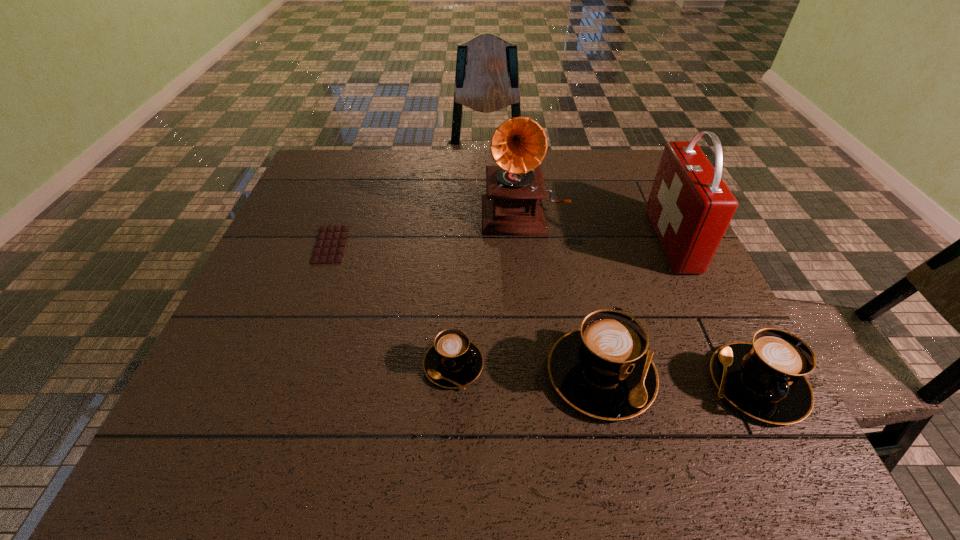
At what (x,y) coordinates should I click in order to perform the action: click on the shortest cappuccino. Please return your answer as a coordinate pair (x, y). This screenshot has height=540, width=960. Looking at the image, I should click on pos(453,361).

I want to click on the second shortest object, so click(x=453, y=361).

At what (x,y) coordinates should I click in order to perform the action: click on the second cappuccino from right to left. Please return your answer as a coordinate pair (x, y). The width and height of the screenshot is (960, 540). Looking at the image, I should click on click(x=602, y=369).

I want to click on the third shortest object, so click(765, 379).

This screenshot has width=960, height=540. I want to click on the second tallest cappuccino, so click(x=765, y=379).

Where is `phonograph record`? Image resolution: width=960 pixels, height=540 pixels. phonograph record is located at coordinates (512, 206).

You are a GUI agent. You are given a task and a screenshot of the screen. Output one action in this format:
    pyautogui.click(x=<x>, y=<y>)
    Task: Click on the first-aid kit
    
    Given the screenshot: What is the action you would take?
    pyautogui.click(x=690, y=207)

Find the location of a particular element. the shortest object is located at coordinates (329, 248).

The image size is (960, 540). Identify the location of chocolate bar. (329, 248).

Locate an element on the screen. Image resolution: width=960 pixels, height=540 pixels. vacant point located 0.150m on the right of the fifth tallest object is located at coordinates (561, 365).